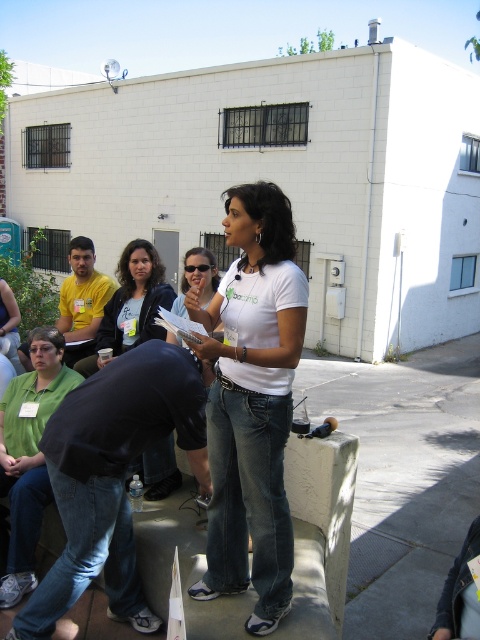
Question: Does matte black jacket at center appear on the left side of yellow t-shirt at left?

Choices:
 (A) yes
 (B) no

Answer: (B)

Question: Is dark blue jeans at lower left to the left of matte black jacket at center from the viewer's perspective?

Choices:
 (A) yes
 (B) no

Answer: (B)

Question: Where is green cotton shirt at lower left located in relation to matte white shirt at center in the image?

Choices:
 (A) below
 (B) above

Answer: (A)

Question: Which of these objects is positioned closest to the dark blue jeans at lower left?

Choices:
 (A) white matte shirt at center
 (B) yellow t-shirt at left

Answer: (A)

Question: Which point appears closest to the camera in this image?

Choices:
 (A) (156, 257)
 (B) (153, 445)
 (C) (83, 276)
 (D) (266, 346)

Answer: (D)

Question: Which point is farther from the camera taking this photo?

Choices:
 (A) (87, 298)
 (B) (237, 204)

Answer: (A)